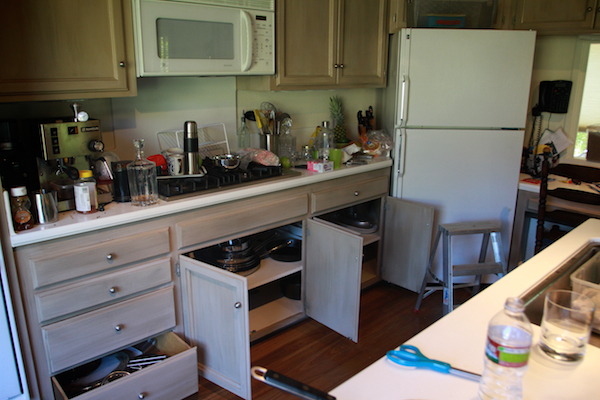
This screenshot has width=600, height=400. I want to click on stored pans, so click(244, 251), click(228, 252), click(236, 265), click(251, 270), click(290, 242), click(370, 227), click(354, 221), click(291, 292), click(269, 255).